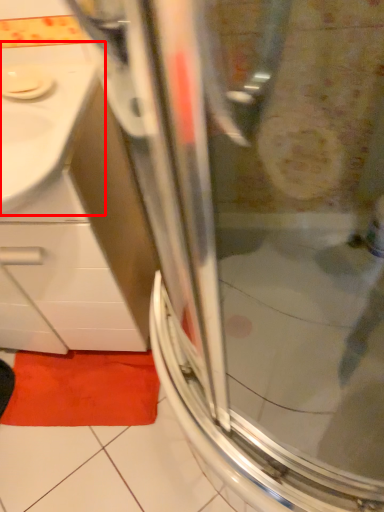
Question: From the image's perspective, what is the correct spatial positioning of sink (annotated by the red box) in reference to bath mat?

Choices:
 (A) below
 (B) above

Answer: (B)